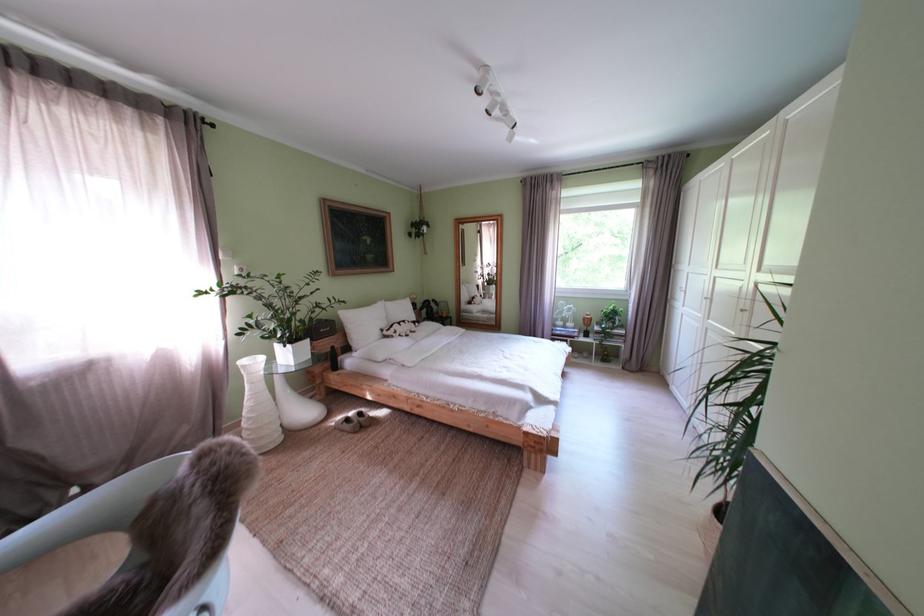
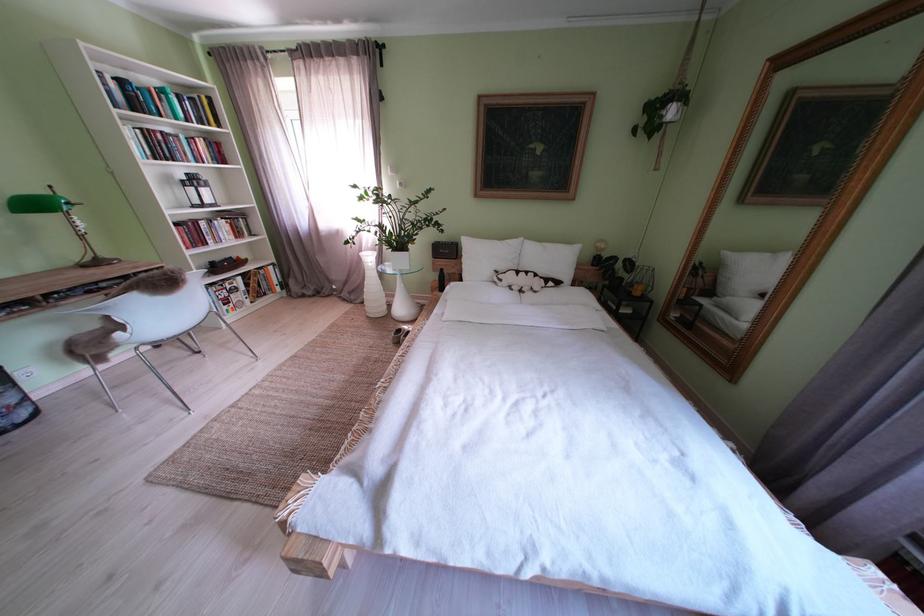
The point at (301, 349) is marked in the first image. Where is the corresponding point in the second image?

(405, 256)